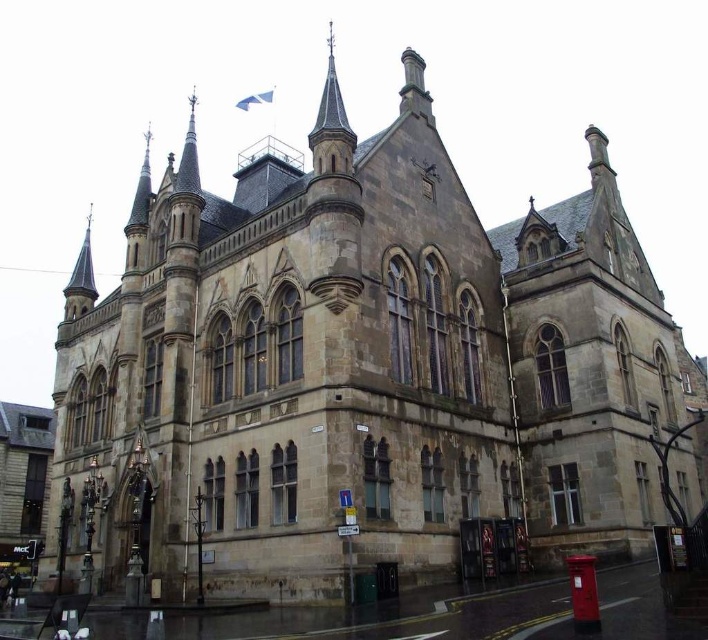
Does point (325, 122) come in front of point (93, 298)?

Yes.

Is dark brown stone spire at upper center shorter than smooth gray spire at upper left?

No, dark brown stone spire at upper center is not shorter than smooth gray spire at upper left.

Locate an element on the screen. This screenshot has height=640, width=708. dark brown stone spire at upper center is located at coordinates (331, 125).

Where is `dark brown stone spire at upper center`? The height and width of the screenshot is (640, 708). dark brown stone spire at upper center is located at coordinates (331, 125).